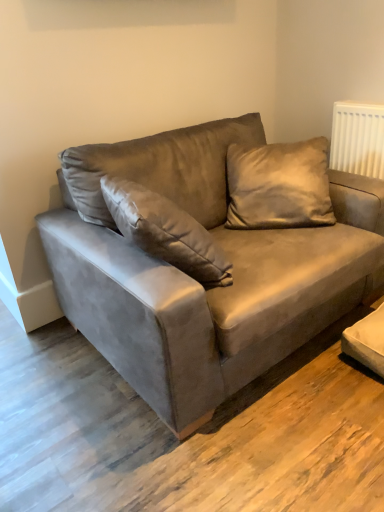
Question: In the image, is suede couch at center positioned in front of or behind suede pillow at upper right?

Choices:
 (A) front
 (B) behind

Answer: (A)

Question: In terms of size, does suede couch at center appear bigger or smaller than suede pillow at upper right?

Choices:
 (A) big
 (B) small

Answer: (A)

Question: Does point (120, 324) appear closer or farther from the camera than point (274, 221)?

Choices:
 (A) farther
 (B) closer

Answer: (B)

Question: In the image, is suede pillow at upper right on the left side or the right side of suede couch at center?

Choices:
 (A) right
 (B) left

Answer: (A)

Question: From the image's perspective, relative to suede couch at center, is suede pillow at upper right above or below?

Choices:
 (A) above
 (B) below

Answer: (A)

Question: Based on their sizes in the image, would you say suede pillow at upper right is bigger or smaller than suede couch at center?

Choices:
 (A) big
 (B) small

Answer: (B)

Question: Is suede pillow at upper right in front of or behind suede couch at center in the image?

Choices:
 (A) behind
 (B) front

Answer: (A)